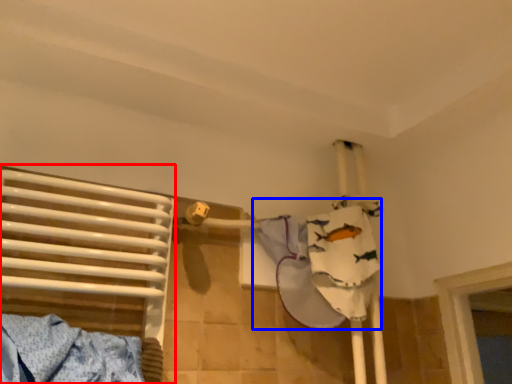
Question: Which of the following is the closest to the observer, bed (highlighted by a red box) or clothing (highlighted by a blue box)?

Choices:
 (A) bed
 (B) clothing

Answer: (A)